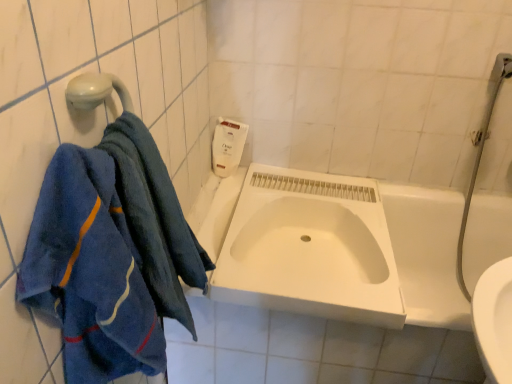
Question: Looking at their shapes, would you say blue terry cloth towel at left, marked as the first towel in a front-to-back arrangement, is wider or thinner than white matte sink at center?

Choices:
 (A) wide
 (B) thin

Answer: (B)

Question: In the image, is blue terry cloth towel at left, marked as the first towel in a front-to-back arrangement, on the left side or the right side of white matte sink at center?

Choices:
 (A) left
 (B) right

Answer: (A)

Question: Which of these objects is positioned farthest from the blue terry cloth towel at left, positioned as the 2th towel in back-to-front order?

Choices:
 (A) white plastic soap dispenser at upper center
 (B) blue terry cloth towel at left, which is the second towel in front-to-back order
 (C) white matte sink at center

Answer: (A)

Question: Considering the real-world distances, which object is farthest from the blue terry cloth towel at left, positioned as the 2th towel in back-to-front order?

Choices:
 (A) white matte sink at center
 (B) blue terry cloth towel at left, which is the second towel in front-to-back order
 (C) white plastic soap dispenser at upper center

Answer: (C)